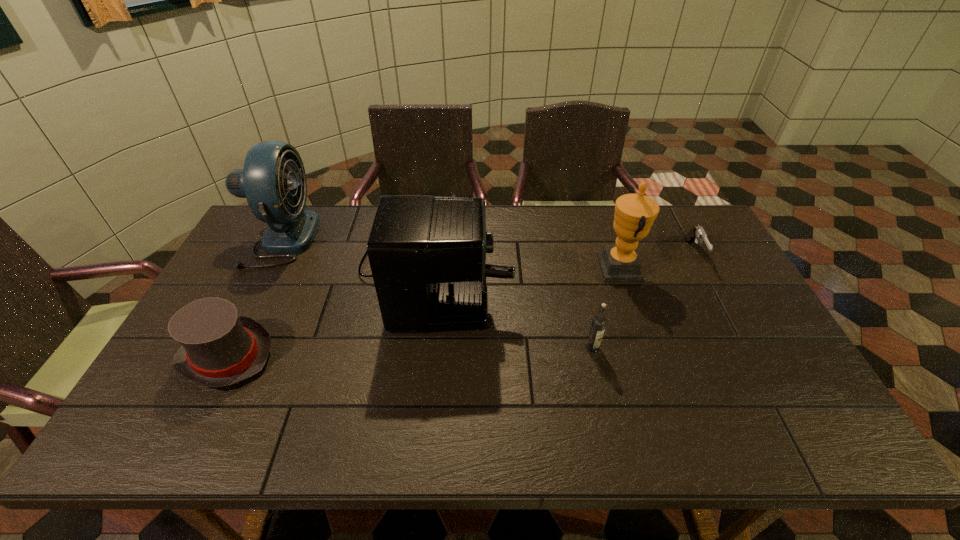
This screenshot has height=540, width=960. Identify the location of dress hat positioned at the left edge. (220, 348).

The height and width of the screenshot is (540, 960). Identify the location of object that is at the right edge. (697, 233).

Image resolution: width=960 pixels, height=540 pixels. I want to click on object that is at the far left corner, so click(x=271, y=167).

Where is `object present at the far right corner`? This screenshot has height=540, width=960. object present at the far right corner is located at coordinates (697, 233).

The image size is (960, 540). What are the coordinates of `free space at the far edge` in the screenshot? It's located at (533, 214).

Locate an element on the screen. Image resolution: width=960 pixels, height=540 pixels. free space at the near edge of the desktop is located at coordinates (535, 420).

At what (x,y) coordinates should I click in order to perform the action: click on vacant region at the left edge of the desktop. Please return your answer as a coordinate pair (x, y). Looking at the image, I should click on [268, 268].

Where is `free location at the right edge of the desktop`? The image size is (960, 540). free location at the right edge of the desktop is located at coordinates coord(738,354).

Find the location of `vacant space at the near left corner`. vacant space at the near left corner is located at coordinates (204, 424).

At what (x,y) coordinates should I click in order to perform the action: click on free space between the fan and the second shortest object. Please return your answer as a coordinate pair (x, y). Looking at the image, I should click on (253, 297).